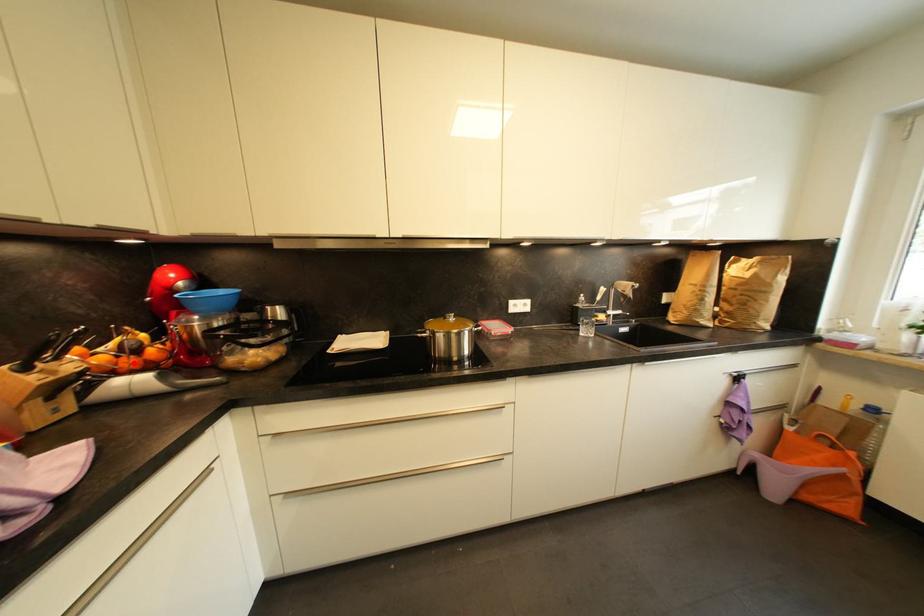
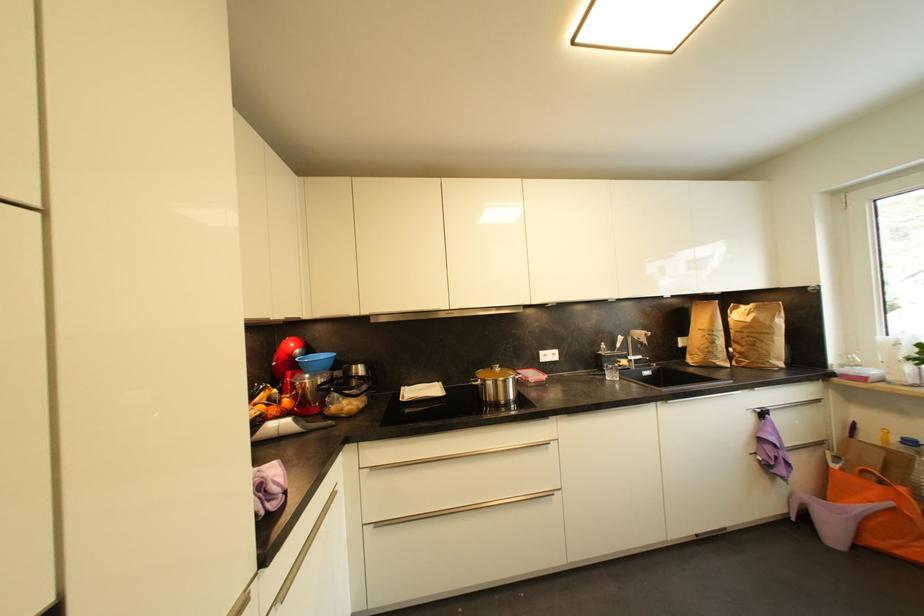
The point at the highlighted location is marked in the first image. Where is the corresponding point in the second image?

(277, 411)